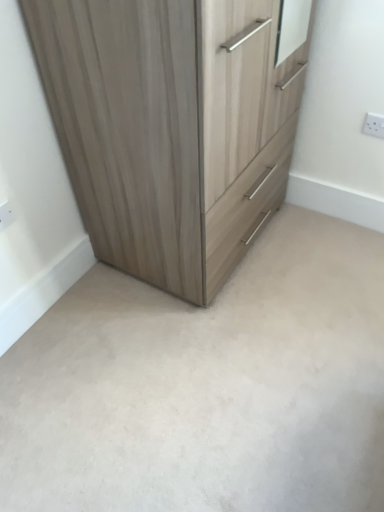
Describe the element at coordinates (173, 125) in the screenshot. I see `light wood/texture chest of drawers at upper left` at that location.

You are a GUI agent. You are given a task and a screenshot of the screen. Output one action in this format:
    pyautogui.click(x=<x>, y=<y>)
    Task: Click on the beige carpet at center
    
    Given the screenshot: What is the action you would take?
    pyautogui.click(x=207, y=386)

Is white plastic electric outlet at upper right, acting as the 1th electric outlet starting from the right, facing away from white plastic electric outlet at lower left, acting as the 2th electric outlet starting from the top?

white plastic electric outlet at upper right, acting as the 1th electric outlet starting from the right, does not have its back to white plastic electric outlet at lower left, acting as the 2th electric outlet starting from the top.

Which is more to the right, white plastic electric outlet at upper right, which is counted as the second electric outlet, starting from the left, or white plastic electric outlet at lower left, which is the first electric outlet from bottom to top?

white plastic electric outlet at upper right, which is counted as the second electric outlet, starting from the left.

From the image's perspective, would you say white plastic electric outlet at upper right, the 1th electric outlet positioned from the top, is positioned over white plastic electric outlet at lower left, which is the second electric outlet in back-to-front order?

Yes.

Does white plastic electric outlet at upper right, placed as the 2th electric outlet when sorted from bottom to top, touch white plastic electric outlet at lower left, arranged as the 2th electric outlet when viewed from the right?

white plastic electric outlet at upper right, placed as the 2th electric outlet when sorted from bottom to top, and white plastic electric outlet at lower left, arranged as the 2th electric outlet when viewed from the right, are not in contact.

From a real-world perspective, is white plastic electric outlet at lower left, positioned as the 1th electric outlet in front-to-back order, beneath white plastic electric outlet at upper right, placed as the 2th electric outlet when sorted from bottom to top?

Indeed, from a real-world perspective, white plastic electric outlet at lower left, positioned as the 1th electric outlet in front-to-back order, is positioned beneath white plastic electric outlet at upper right, placed as the 2th electric outlet when sorted from bottom to top.

Is white plastic electric outlet at lower left, which is the 1th electric outlet in left-to-right order, far away from white plastic electric outlet at upper right, the first electric outlet when ordered from back to front?

Yes.

Does white plastic electric outlet at lower left, arranged as the 2th electric outlet when viewed from the right, have a lesser height compared to white plastic electric outlet at upper right, which is counted as the second electric outlet, starting from the left?

Indeed, white plastic electric outlet at lower left, arranged as the 2th electric outlet when viewed from the right, has a lesser height compared to white plastic electric outlet at upper right, which is counted as the second electric outlet, starting from the left.

Between white plastic electric outlet at lower left, positioned as the 1th electric outlet in front-to-back order, and white plastic electric outlet at upper right, the first electric outlet when ordered from back to front, which one is positioned in front?

white plastic electric outlet at lower left, positioned as the 1th electric outlet in front-to-back order, is in front.

What's the angular difference between white plastic electric outlet at lower left, which is the second electric outlet in back-to-front order, and beige carpet at center's facing directions?

They differ by 90.9 degrees in their facing directions.

Who is bigger, white plastic electric outlet at lower left, arranged as the 2th electric outlet when viewed from the right, or beige carpet at center?

With larger size is beige carpet at center.

Which is correct: white plastic electric outlet at lower left, which is the 1th electric outlet in left-to-right order, is inside beige carpet at center, or outside of it?

white plastic electric outlet at lower left, which is the 1th electric outlet in left-to-right order, is located beyond the bounds of beige carpet at center.

Is white plastic electric outlet at lower left, positioned as the 1th electric outlet in front-to-back order, at the right side of beige carpet at center?

In fact, white plastic electric outlet at lower left, positioned as the 1th electric outlet in front-to-back order, is to the left of beige carpet at center.

From the image's perspective, which one is positioned higher, white plastic electric outlet at upper right, acting as the 1th electric outlet starting from the right, or light wood/texture chest of drawers at upper left?

From the image's view, white plastic electric outlet at upper right, acting as the 1th electric outlet starting from the right, is above.

From a real-world perspective, is white plastic electric outlet at upper right, acting as the 1th electric outlet starting from the right, above or below light wood/texture chest of drawers at upper left?

From a real-world perspective, white plastic electric outlet at upper right, acting as the 1th electric outlet starting from the right, is physically below light wood/texture chest of drawers at upper left.

Does white plastic electric outlet at upper right, which is counted as the second electric outlet, starting from the left, appear on the right side of light wood/texture chest of drawers at upper left?

Indeed, white plastic electric outlet at upper right, which is counted as the second electric outlet, starting from the left, is positioned on the right side of light wood/texture chest of drawers at upper left.

From a real-world perspective, count 1st electric outlets downward from the light wood/texture chest of drawers at upper left and point to it. Please provide its 2D coordinates.

[(374, 125)]

Does beige carpet at center have a smaller size compared to white plastic electric outlet at upper right, the first electric outlet when ordered from back to front?

Incorrect, beige carpet at center is not smaller in size than white plastic electric outlet at upper right, the first electric outlet when ordered from back to front.

Is beige carpet at center shorter than white plastic electric outlet at upper right, acting as the 1th electric outlet starting from the right?

Indeed, beige carpet at center has a lesser height compared to white plastic electric outlet at upper right, acting as the 1th electric outlet starting from the right.

Image resolution: width=384 pixels, height=512 pixels. In the image, there is a white plastic electric outlet at upper right, placed as the 2th electric outlet when sorted from bottom to top. In order to click on concrete below it (from the image's perspective) in this screenshot , I will do `click(207, 386)`.

Can you confirm if light wood/texture chest of drawers at upper left is bigger than white plastic electric outlet at lower left, which is the 1th electric outlet in left-to-right order?

Yes.

Is light wood/texture chest of drawers at upper left looking in the opposite direction of white plastic electric outlet at lower left, arranged as the 2th electric outlet when viewed from the right?

No, light wood/texture chest of drawers at upper left is not facing away from white plastic electric outlet at lower left, arranged as the 2th electric outlet when viewed from the right.

Between light wood/texture chest of drawers at upper left and white plastic electric outlet at lower left, positioned as the 1th electric outlet in front-to-back order, which one has smaller width?

white plastic electric outlet at lower left, positioned as the 1th electric outlet in front-to-back order.

From the image's perspective, between light wood/texture chest of drawers at upper left and white plastic electric outlet at lower left, which is the 1th electric outlet in left-to-right order, which one is located above?

light wood/texture chest of drawers at upper left, from the image's perspective.

From a real-world perspective, which is physically above, white plastic electric outlet at upper right, which is counted as the second electric outlet, starting from the left, or beige carpet at center?

white plastic electric outlet at upper right, which is counted as the second electric outlet, starting from the left, is physically above.

Is white plastic electric outlet at upper right, which is counted as the second electric outlet, starting from the left, looking in the opposite direction of beige carpet at center?

No, white plastic electric outlet at upper right, which is counted as the second electric outlet, starting from the left,'s orientation is not away from beige carpet at center.

What's the angular difference between white plastic electric outlet at upper right, placed as the 2th electric outlet when sorted from bottom to top, and beige carpet at center's facing directions?

The angle between the facing direction of white plastic electric outlet at upper right, placed as the 2th electric outlet when sorted from bottom to top, and the facing direction of beige carpet at center is 0.0507 degrees.

Is the position of white plastic electric outlet at upper right, acting as the 1th electric outlet starting from the right, more distant than that of beige carpet at center?

Yes, white plastic electric outlet at upper right, acting as the 1th electric outlet starting from the right, is further from the camera.

This screenshot has height=512, width=384. Identify the location of electric outlet below the white plastic electric outlet at upper right, the first electric outlet when ordered from back to front (from a real-world perspective). [6, 215].

Identify the location of electric outlet in front of the white plastic electric outlet at upper right, acting as the 1th electric outlet starting from the right. (6, 215).

Looking at this image, considering their positions, is beige carpet at center positioned further to light wood/texture chest of drawers at upper left than white plastic electric outlet at lower left, positioned as the 1th electric outlet in front-to-back order?

white plastic electric outlet at lower left, positioned as the 1th electric outlet in front-to-back order, is positioned further to the anchor light wood/texture chest of drawers at upper left.

Estimate the real-world distances between objects in this image. Which object is further from beige carpet at center, light wood/texture chest of drawers at upper left or white plastic electric outlet at upper right, the 2th electric outlet viewed from the front?

The object further to beige carpet at center is white plastic electric outlet at upper right, the 2th electric outlet viewed from the front.

From the image, which object appears to be farther from white plastic electric outlet at upper right, acting as the 1th electric outlet starting from the right, light wood/texture chest of drawers at upper left or beige carpet at center?

beige carpet at center is further to white plastic electric outlet at upper right, acting as the 1th electric outlet starting from the right.

Consider the image. Estimate the real-world distances between objects in this image. Which object is closer to white plastic electric outlet at lower left, which is the first electric outlet from bottom to top, light wood/texture chest of drawers at upper left or beige carpet at center?

light wood/texture chest of drawers at upper left lies closer to white plastic electric outlet at lower left, which is the first electric outlet from bottom to top, than the other object.

Looking at the image, which one is located further to white plastic electric outlet at upper right, placed as the 2th electric outlet when sorted from bottom to top, white plastic electric outlet at lower left, which is the first electric outlet from bottom to top, or beige carpet at center?

Based on the image, white plastic electric outlet at lower left, which is the first electric outlet from bottom to top, appears to be further to white plastic electric outlet at upper right, placed as the 2th electric outlet when sorted from bottom to top.

Based on their spatial positions, is white plastic electric outlet at upper right, the 2th electric outlet viewed from the front, or beige carpet at center further from light wood/texture chest of drawers at upper left?

white plastic electric outlet at upper right, the 2th electric outlet viewed from the front, is positioned further to the anchor light wood/texture chest of drawers at upper left.

From the picture: When comparing their distances from white plastic electric outlet at upper right, the 2th electric outlet viewed from the front, does light wood/texture chest of drawers at upper left or white plastic electric outlet at lower left, which is the first electric outlet from bottom to top, seem closer?

The object closer to white plastic electric outlet at upper right, the 2th electric outlet viewed from the front, is light wood/texture chest of drawers at upper left.

Considering their positions, is light wood/texture chest of drawers at upper left positioned further to beige carpet at center than white plastic electric outlet at lower left, arranged as the 2th electric outlet when viewed from the right?

white plastic electric outlet at lower left, arranged as the 2th electric outlet when viewed from the right, is positioned further to the anchor beige carpet at center.

Locate an element on the screen. The height and width of the screenshot is (512, 384). the chest of drawers situated between white plastic electric outlet at lower left, arranged as the 2th electric outlet when viewed from the right, and beige carpet at center from left to right is located at coordinates (173, 125).

Where is `concrete situated between white plastic electric outlet at lower left, acting as the 2th electric outlet starting from the top, and white plastic electric outlet at upper right, the 2th electric outlet viewed from the front, from left to right`? Image resolution: width=384 pixels, height=512 pixels. concrete situated between white plastic electric outlet at lower left, acting as the 2th electric outlet starting from the top, and white plastic electric outlet at upper right, the 2th electric outlet viewed from the front, from left to right is located at coordinates click(207, 386).

Locate an element on the screen. The height and width of the screenshot is (512, 384). chest of drawers between white plastic electric outlet at lower left, which is the 1th electric outlet in left-to-right order, and white plastic electric outlet at upper right, the 2th electric outlet viewed from the front, in the horizontal direction is located at coordinates (173, 125).

Image resolution: width=384 pixels, height=512 pixels. I want to click on chest of drawers between white plastic electric outlet at upper right, acting as the 1th electric outlet starting from the right, and beige carpet at center in the up-down direction, so click(x=173, y=125).